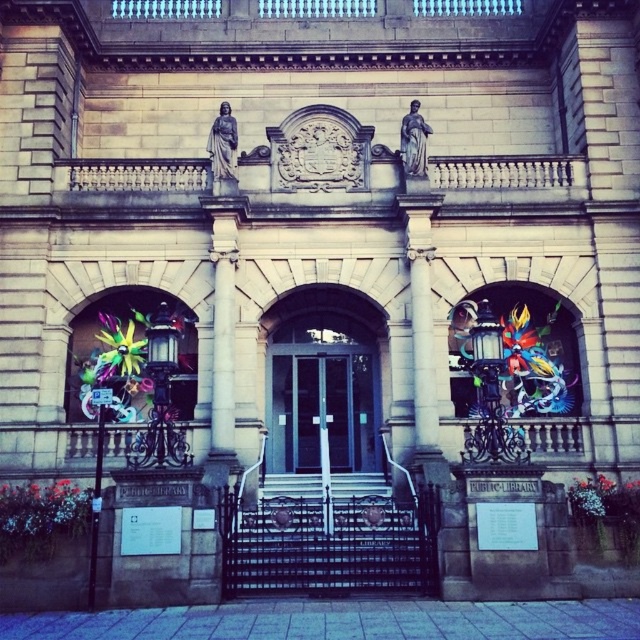
What do you see at coordinates (321, 412) in the screenshot?
I see `matte glass doors at center` at bounding box center [321, 412].

Does matte glass doors at center have a lesser height compared to white stone stairs at center?

Incorrect, matte glass doors at center's height does not fall short of white stone stairs at center's.

Is point (340, 456) behind point (376, 472)?

Yes, it is behind point (376, 472).

I want to click on matte glass doors at center, so click(321, 412).

Is matte glass doors at center bigger than white marble pillar at center?

Actually, matte glass doors at center might be smaller than white marble pillar at center.

Between matte glass doors at center and white marble pillar at center, which one has more height?

white marble pillar at center

Which is behind, point (301, 444) or point (221, 339)?

Point (301, 444)

Identify the location of matte glass doors at center. Image resolution: width=640 pixels, height=640 pixels. (321, 412).

Is the position of white marble pillar at center more distant than that of white stone stairs at center?

That is False.

Between point (228, 371) and point (288, 496), which one is positioned in front?

Point (228, 371) is in front.

This screenshot has width=640, height=640. Find the location of `white marble pillar at center`. white marble pillar at center is located at coordinates (221, 353).